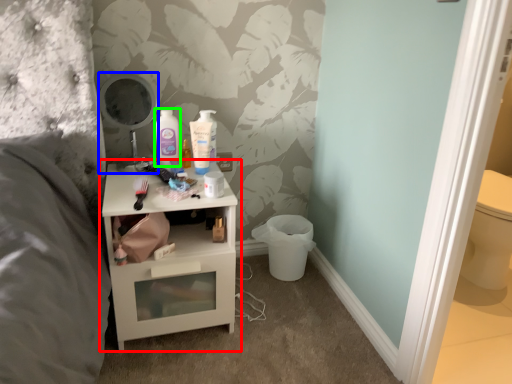
Question: Which object is the closest to the nightstand (highlighted by a red box)? Choose among these: mirror (highlighted by a blue box) or mouthwash (highlighted by a green box).

Choices:
 (A) mirror
 (B) mouthwash

Answer: (A)